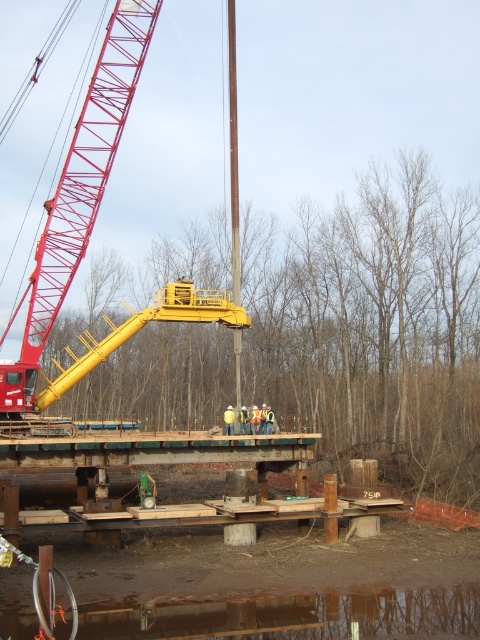
You are a construction worker standing on the wooden platform and want to reach the crane operator for instructions. You have two points to navigate to before reaching the crane operator. The first point is at coordinates point (132, 58) and the second is at point (248, 616). Which point should you go to first to minimize the distance traveled?

You should go to point (132, 58) first because it is closer to you than point (248, 616) since it is further to the camera.

You are a safety inspector at the construction site. You need to ensure that the red metal crane at upper left maintains a safe distance of at least 50 feet from the brown reflective water at lower center to prevent accidents. Based on the provided information, is the current distance compliant with safety regulations?

The distance between the red metal crane at upper left and the brown reflective water at lower center is 49.82 feet, which is slightly less than the required 50 feet. Therefore, the current distance does not comply with safety regulations and needs adjustment to meet the minimum safety requirement.

You are a safety inspector at the construction site. You need to ensure that the red metal crane at upper left does not interfere with the workers on the wooden platform near the brown reflective water at lower center. Based on the scene description, can you confirm if the crane is positioned in a safe location relative to the workers?

The red metal crane at upper left is above the brown reflective water at lower center, which is where the workers are located. This positioning means the crane is directly overhead, so there is a risk of falling objects or the crane arm swinging into the workers area. The inspector should ensure safety measures are in place to protect the workers below.